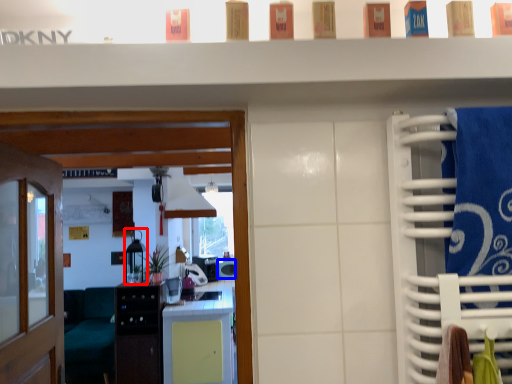
Question: Which point is closer to the camera, appliance (highlighted by a red box) or appliance (highlighted by a blue box)?

Choices:
 (A) appliance
 (B) appliance

Answer: (A)